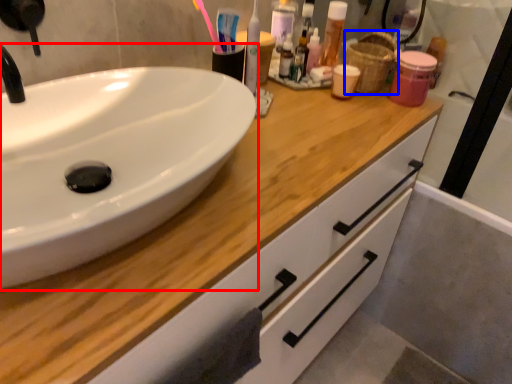
Question: Among these objects, which one is nearest to the camera, sink (highlighted by a red box) or basket (highlighted by a blue box)?

Choices:
 (A) sink
 (B) basket

Answer: (A)